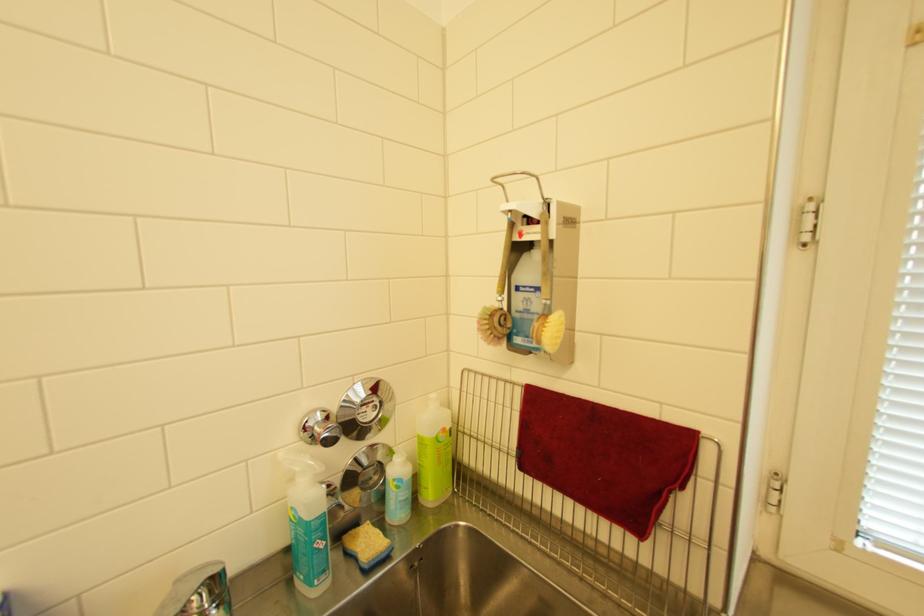
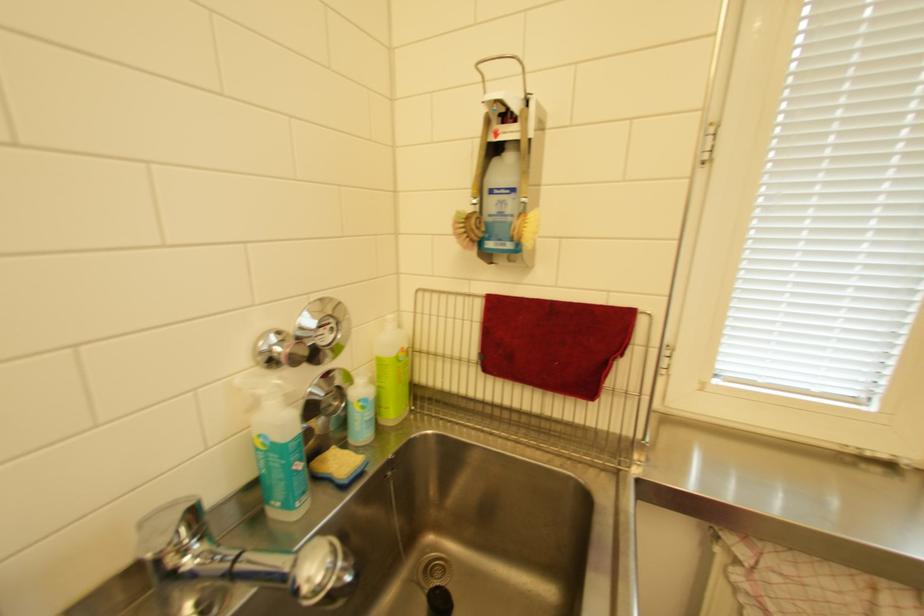
In the second image, find the point that corresponds to the point at 334,546 in the first image.

(312, 467)